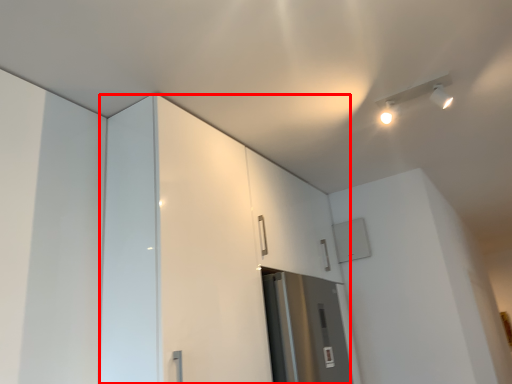
Question: From the image's perspective, where is dresser (annotated by the red box) located relative to light fixture?

Choices:
 (A) below
 (B) above

Answer: (A)